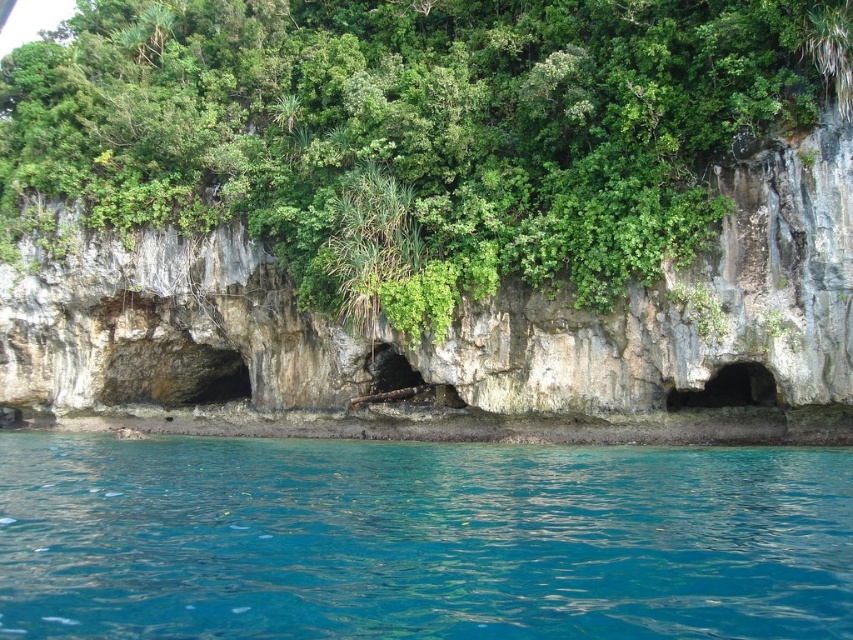
Question: Can you confirm if green leafy tree at center is positioned below clear blue water at lower center?

Choices:
 (A) yes
 (B) no

Answer: (B)

Question: Is green leafy tree at center positioned before clear blue water at lower center?

Choices:
 (A) no
 (B) yes

Answer: (A)

Question: Where is green leafy tree at center located in relation to clear blue water at lower center in the image?

Choices:
 (A) left
 (B) right

Answer: (A)

Question: Which object is farther from the camera taking this photo?

Choices:
 (A) clear blue water at lower center
 (B) green leafy tree at center

Answer: (B)

Question: Which of the following is the closest to the observer?

Choices:
 (A) (546, 74)
 (B) (340, 541)

Answer: (B)